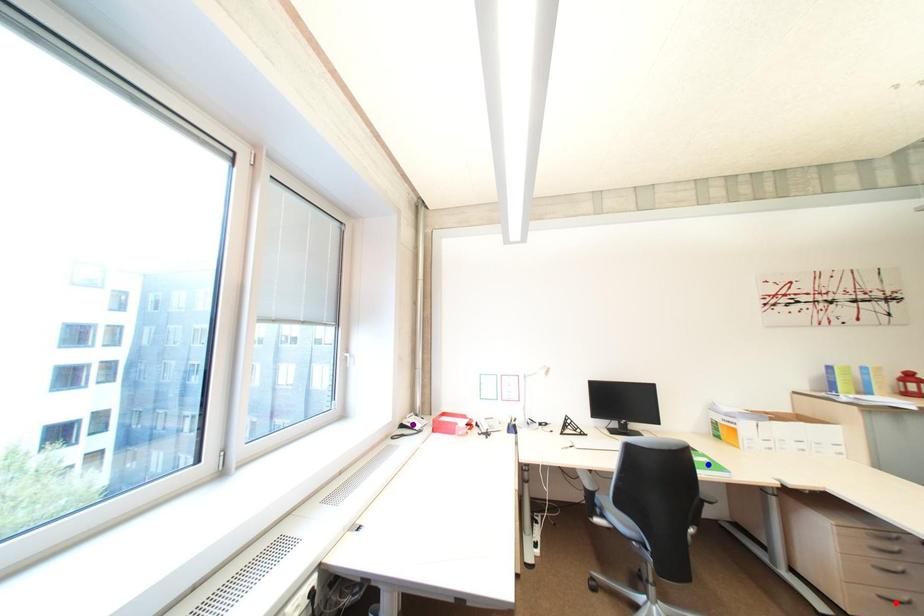
Order these from nearest to farthest:
blue point, purple point, red point

purple point, blue point, red point